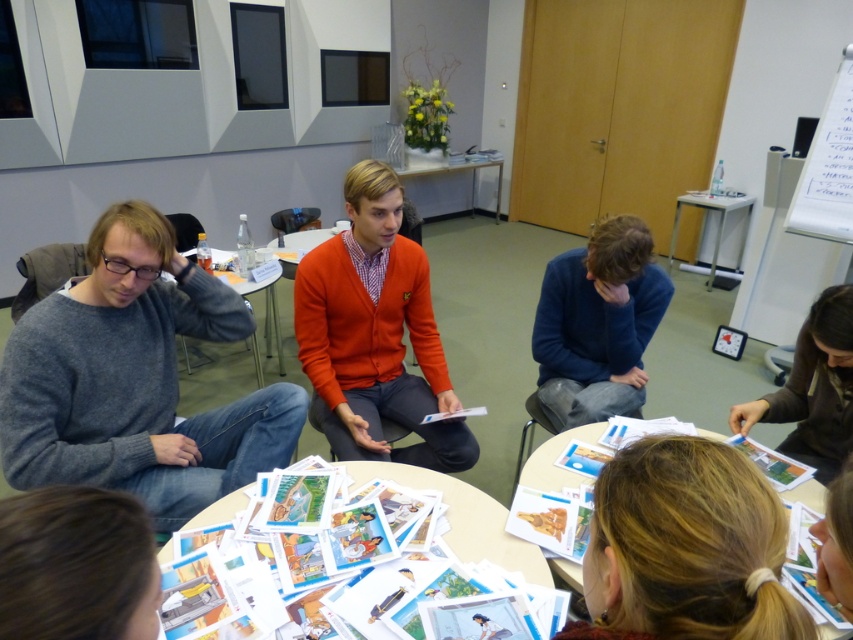
You need to place a 10cm wide notebook on the table. Which table, the matte gray table at center or the white glossy table at upper center, can accommodate it without overhanging?

The white glossy table at upper center can accommodate the 10cm wide notebook since it is wider than the matte gray table at center.

You are organizing a small workshop and need to place a 15 cm wide notebook on either the white paper at lower center or the metallic silver table at upper right. Based on their sizes, which surface can accommodate the notebook without it hanging off the edge?

The metallic silver table at upper right can accommodate the notebook since the white paper at lower center is narrower than the metallic silver table at upper right according to the description.